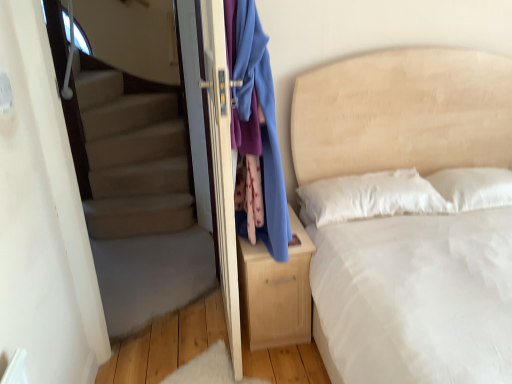
Question: From a real-world perspective, is beige fabric bed at center physically located above or below matte white screen door at center?

Choices:
 (A) above
 (B) below

Answer: (B)

Question: Considering the positions of beige fabric bed at center and matte white screen door at center in the image, is beige fabric bed at center bigger or smaller than matte white screen door at center?

Choices:
 (A) big
 (B) small

Answer: (A)

Question: Considering the real-world distances, which object is closest to the carpeted stairs at left?

Choices:
 (A) blue fabric at center
 (B) beige fabric bed at center
 (C) light wood nightstand at center
 (D) matte white screen door at center

Answer: (D)

Question: Estimate the real-world distances between objects in this image. Which object is closer to the blue fabric at center?

Choices:
 (A) matte white screen door at center
 (B) light wood nightstand at center
 (C) beige fabric bed at center
 (D) carpeted stairs at left

Answer: (B)